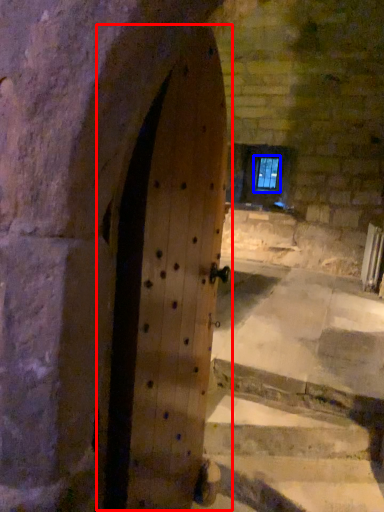
Question: Which point is closer to the camera, door (highlighted by a red box) or window (highlighted by a blue box)?

Choices:
 (A) door
 (B) window

Answer: (A)